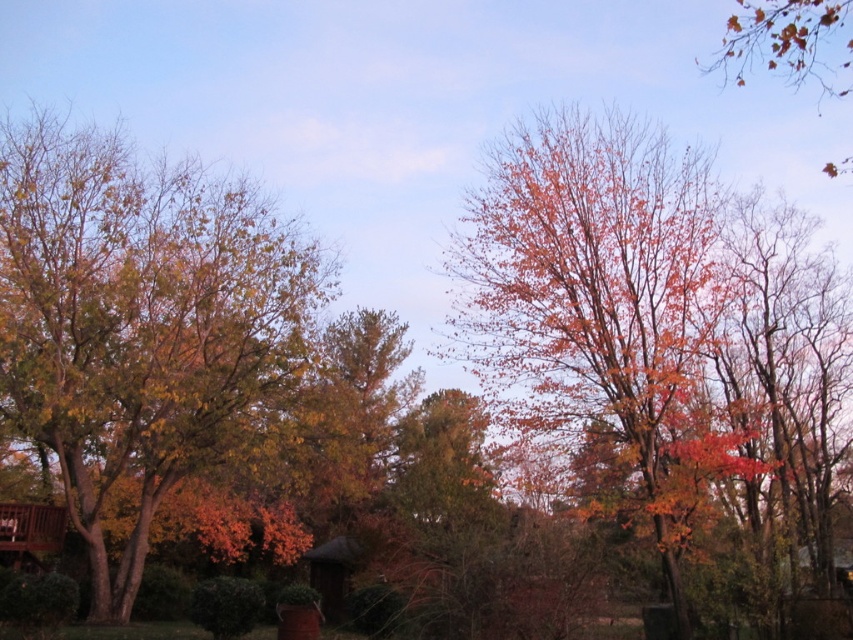
Question: Which point is closer to the camera?

Choices:
 (A) (769, 48)
 (B) (781, 492)

Answer: (B)

Question: In this image, where is shiny orange leaves at center located relative to orange leafy tree at upper right?

Choices:
 (A) right
 (B) left

Answer: (B)

Question: Which object is the farthest from the yellow-green foliage at left?

Choices:
 (A) shiny orange leaves at center
 (B) orange leafy tree at upper right

Answer: (B)

Question: Which point is closer to the camera?

Choices:
 (A) (729, 35)
 (B) (254, 316)
 (C) (656, 253)

Answer: (C)

Question: Is shiny orange leaves at center to the right of orange leafy tree at upper right from the viewer's perspective?

Choices:
 (A) no
 (B) yes

Answer: (A)

Question: Can you confirm if yellow-green foliage at left is positioned above orange leafy tree at upper right?

Choices:
 (A) yes
 (B) no

Answer: (B)